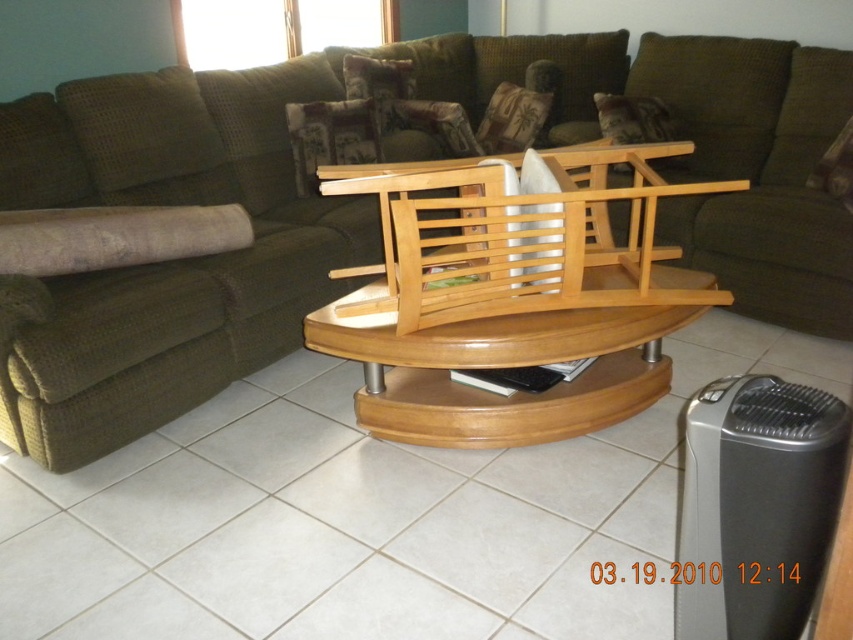
Question: Which of the following is the closest to the observer?

Choices:
 (A) (113, 449)
 (B) (573, 276)

Answer: (B)

Question: Estimate the real-world distances between objects in this image. Which object is closer to the green fabric couch at center?

Choices:
 (A) wooden table at center
 (B) natural wood rocking chair at center

Answer: (B)

Question: Considering the real-world distances, which object is closest to the natural wood rocking chair at center?

Choices:
 (A) green fabric couch at center
 (B) wooden table at center

Answer: (B)

Question: In this image, where is wooden table at center located relative to natural wood rocking chair at center?

Choices:
 (A) left
 (B) right

Answer: (B)

Question: Is green fabric couch at center thinner than natural wood rocking chair at center?

Choices:
 (A) no
 (B) yes

Answer: (A)

Question: Is green fabric couch at center bigger than wooden table at center?

Choices:
 (A) yes
 (B) no

Answer: (A)